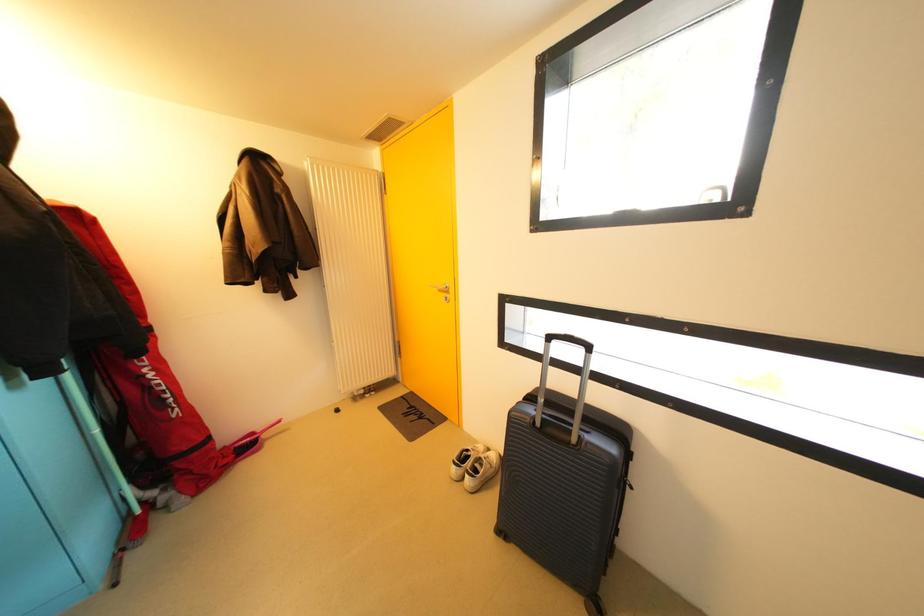
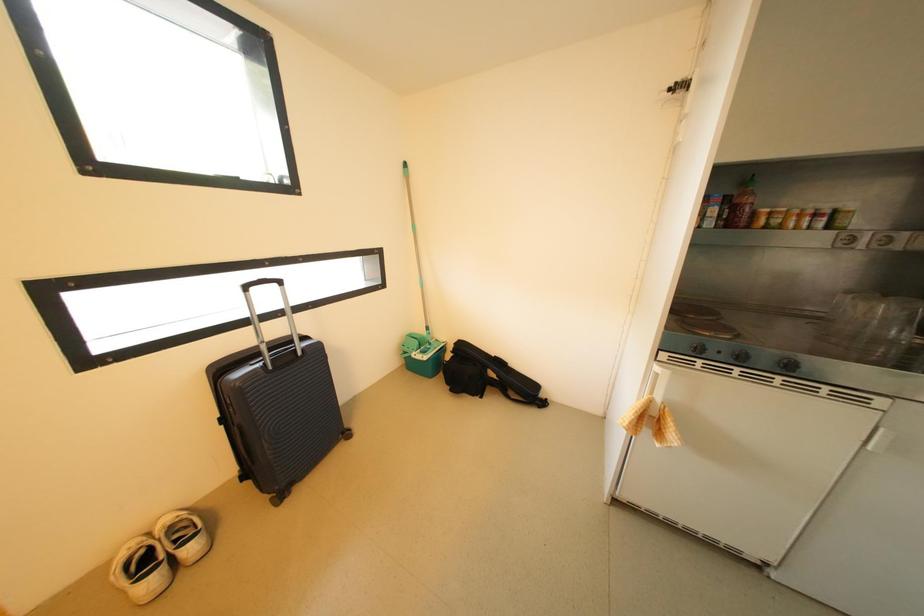
The images are taken continuously from a first-person perspective. In which direction is your viewpoint rotating?

The camera's rotation is toward right-down.